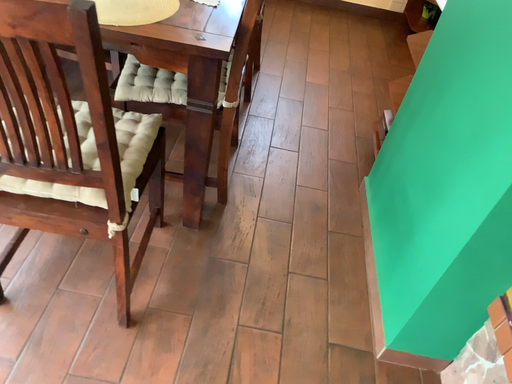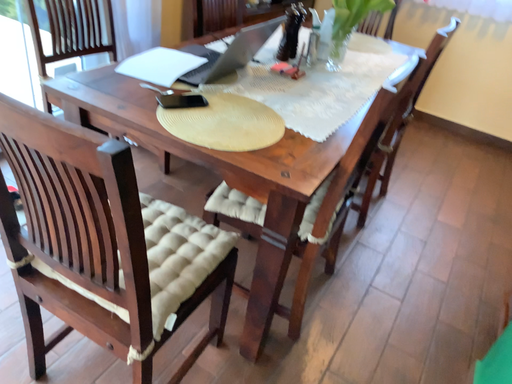
Question: How did the camera likely rotate when shooting the video?

Choices:
 (A) rotated right
 (B) rotated left

Answer: (B)